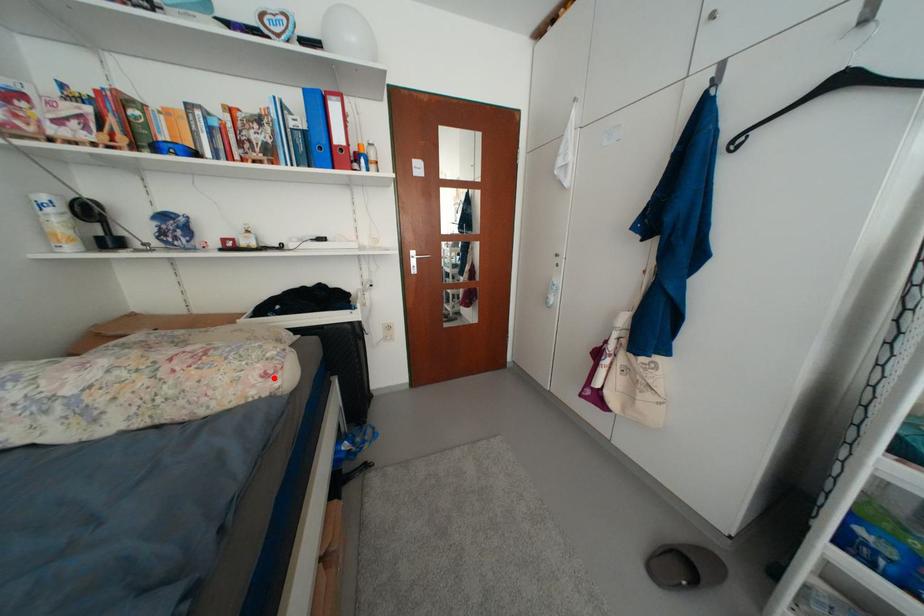
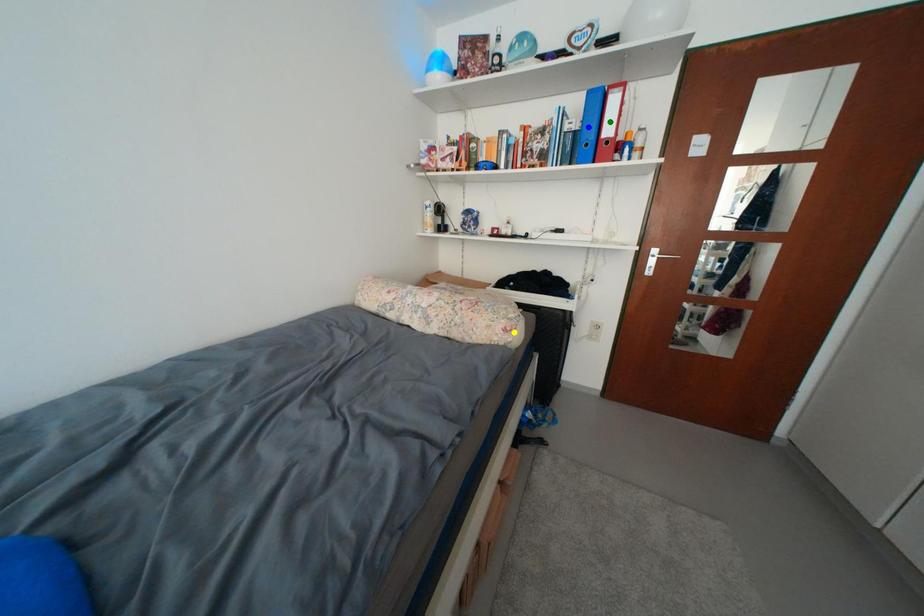
Question: I am providing you with two images of the same scene from different viewpoints. A red point is marked on the first image. You are given multiple points on the second image. Which point in image 2 represents the same 3d spot as the red point in image 1?

Choices:
 (A) yellow point
 (B) green point
 (C) blue point

Answer: (A)